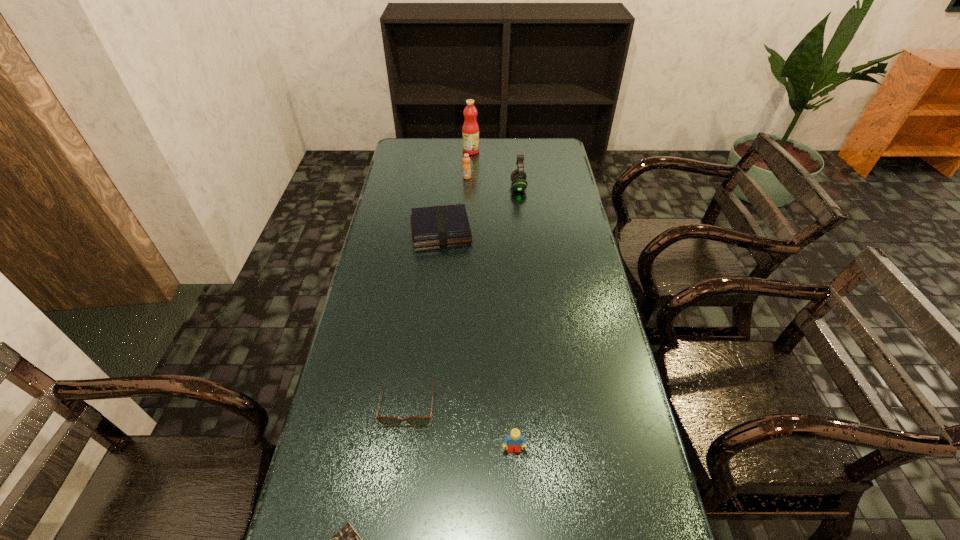
Where is `object that is at the far edge`? Image resolution: width=960 pixels, height=540 pixels. object that is at the far edge is located at coordinates (470, 131).

Find the location of `book present at the left edge`. book present at the left edge is located at coordinates click(x=440, y=225).

Find the location of a particular element. The image size is (960, 540). spectacles that is at the left edge is located at coordinates (419, 421).

In order to click on free location at the far edge of the desktop in this screenshot , I will do `click(436, 151)`.

Find the location of `vacant space at the left edge of the desktop`. vacant space at the left edge of the desktop is located at coordinates (389, 273).

This screenshot has height=540, width=960. What are the coordinates of `vacant space at the right edge of the desktop` in the screenshot? It's located at (573, 189).

At what (x,y) coordinates should I click in order to perform the action: click on empty space that is in between the farther book and the fruit juice. Please return your answer as a coordinate pair (x, y). Looking at the image, I should click on (456, 191).

This screenshot has width=960, height=540. Find the location of `free space between the fourth shortest object and the second tallest object`. free space between the fourth shortest object and the second tallest object is located at coordinates (516, 319).

Locate an element on the screen. free area in between the third shortest object and the fourth shortest object is located at coordinates (477, 340).

Find the location of a particular element. The width and height of the screenshot is (960, 540). blank region between the farther book and the second nearest object is located at coordinates (477, 340).